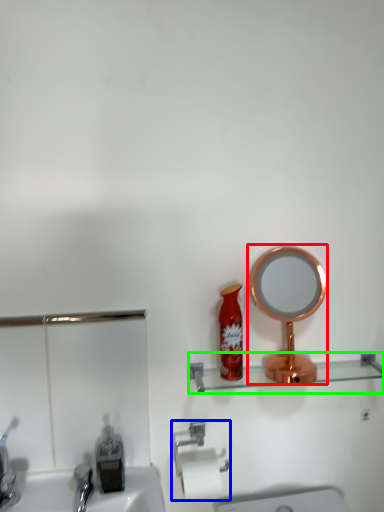
Question: Based on their relative distances, which object is nearer to mirror (highlighted by a red box)? Choose from towel bar (highlighted by a blue box) and shelve (highlighted by a green box).

Choices:
 (A) towel bar
 (B) shelve

Answer: (B)